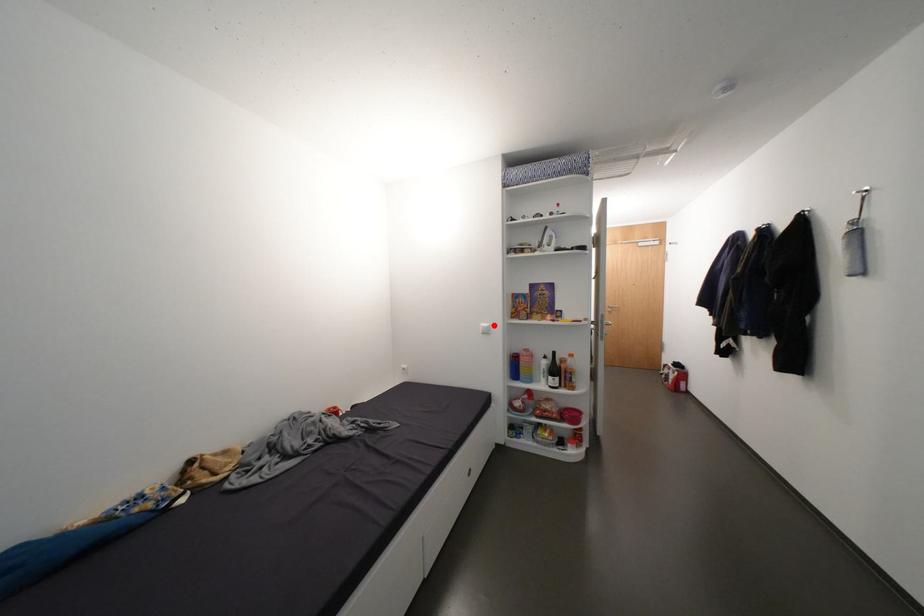
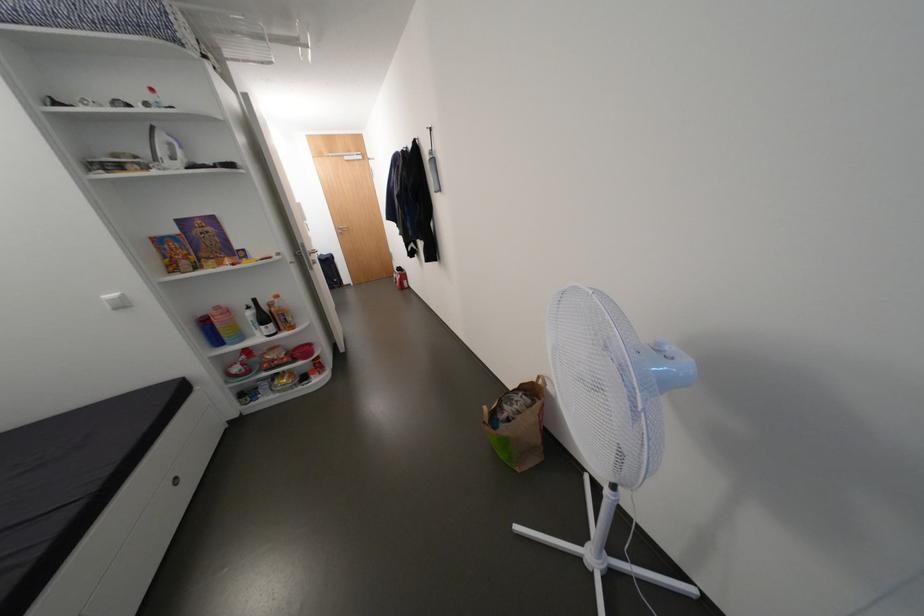
Find the pixel in the second image that matches the highlighted location in the first image.

(120, 296)